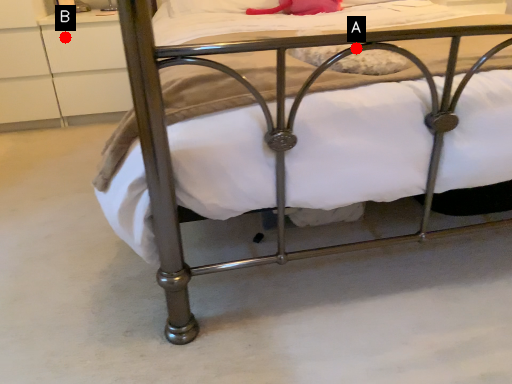
Question: Two points are circled on the image, labeled by A and B beside each circle. Which of the following is the farthest from the observer?

Choices:
 (A) A is further
 (B) B is further

Answer: (B)